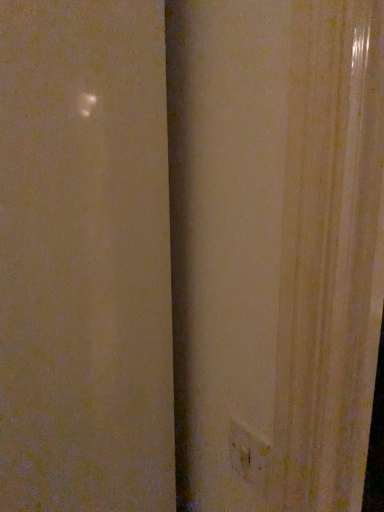
Image resolution: width=384 pixels, height=512 pixels. What do you see at coordinates (248, 455) in the screenshot? I see `white glossy electric outlet at lower center` at bounding box center [248, 455].

This screenshot has width=384, height=512. In order to click on white glossy electric outlet at lower center in this screenshot , I will do `click(248, 455)`.

Identify the location of white glossy electric outlet at lower center. (248, 455).